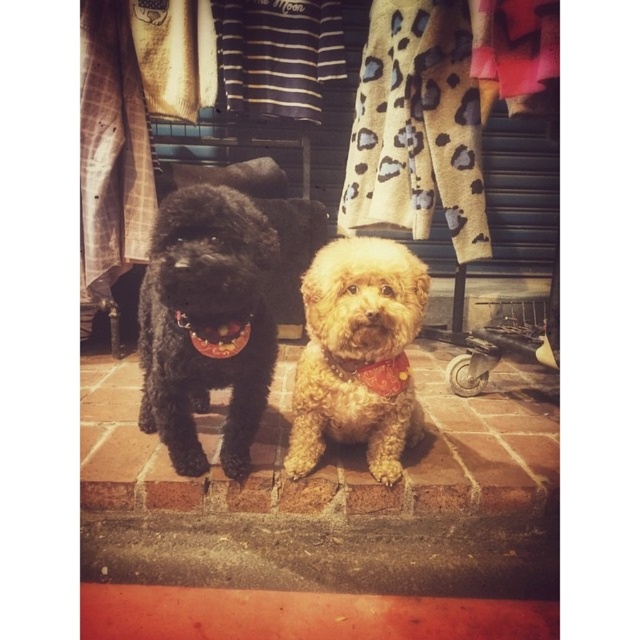
Can you confirm if shiny black dog at center is wider than red fabric neckband at center?

Yes, shiny black dog at center is wider than red fabric neckband at center.

Who is more distant from viewer, (218, 244) or (369, 388)?

Point (369, 388)

Between point (269, 372) and point (371, 364), which one is positioned in front?

Point (371, 364) is more forward.

The height and width of the screenshot is (640, 640). Find the location of `shiny black dog at center`. shiny black dog at center is located at coordinates tap(205, 323).

Is shiny black dog at center to the right of orange fabric neckband at center from the viewer's perspective?

Incorrect, shiny black dog at center is not on the right side of orange fabric neckband at center.

Where is `shiny black dog at center`? shiny black dog at center is located at coordinates (205, 323).

Is point (308, 330) closer to viewer compared to point (376, 385)?

Yes, it is.

Between orange fabric neckband at center and red fabric neckband at center, which one is positioned lower?

orange fabric neckband at center is below.

Who is more forward, (349, 408) or (380, 374)?

Positioned in front is point (380, 374).

The image size is (640, 640). Identify the location of orange fabric neckband at center. (356, 355).